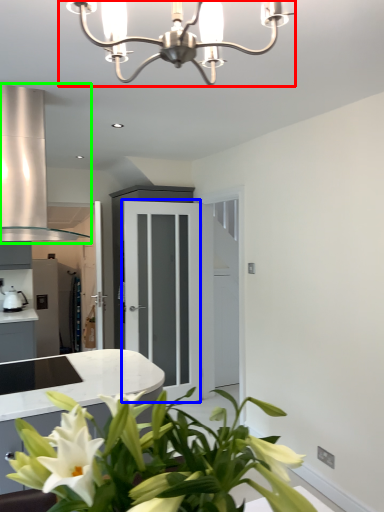
Question: Based on their relative distances, which object is nearer to lamp (highlighted by a red box)? Choose from glass door (highlighted by a blue box) and exhaust hood (highlighted by a green box).

Choices:
 (A) glass door
 (B) exhaust hood

Answer: (B)